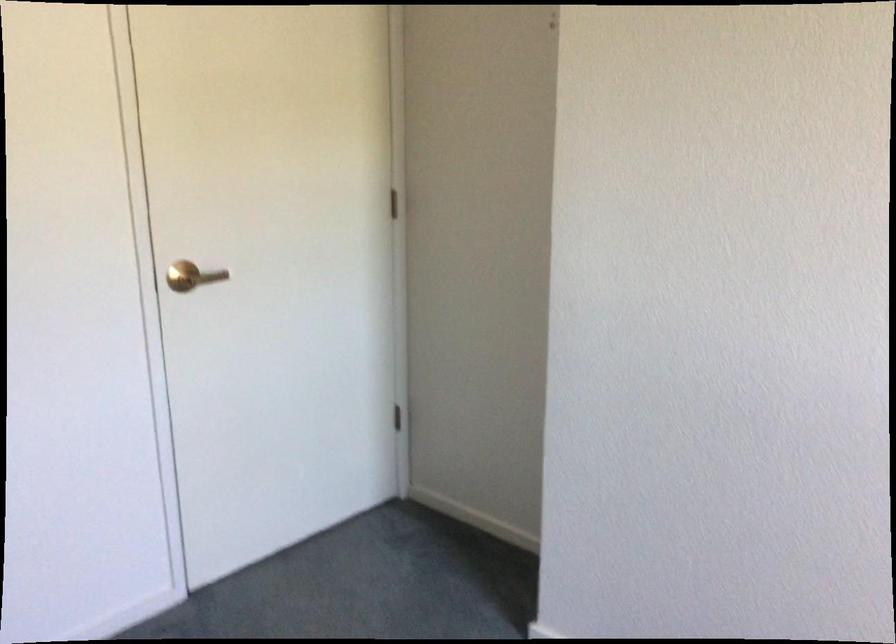
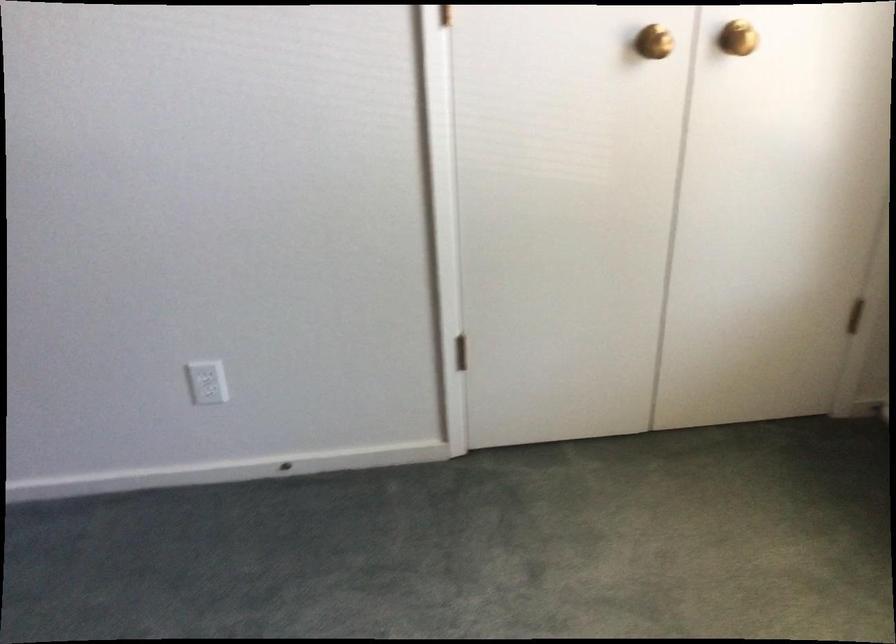
The first image is from the beginning of the video and the second image is from the end. How did the camera likely rotate when shooting the video?

The camera's rotation is toward right-down.